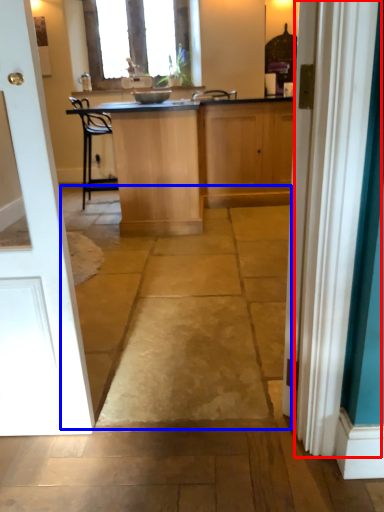
Question: Among these objects, which one is farthest to the camera, curtain (highlighted by a red box) or path (highlighted by a blue box)?

Choices:
 (A) curtain
 (B) path

Answer: (B)